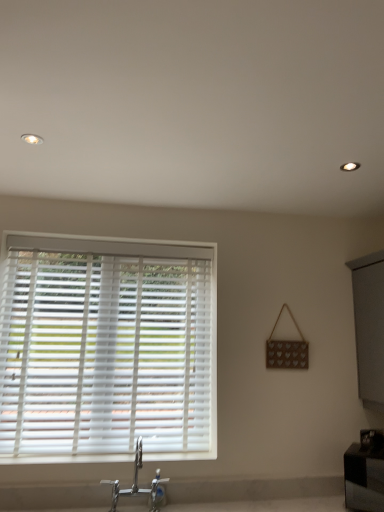
Question: Can you confirm if white plastic blinds at left is thinner than chrome metallic faucet at lower center?

Choices:
 (A) no
 (B) yes

Answer: (B)

Question: Is white plastic blinds at left to the right of chrome metallic faucet at lower center from the viewer's perspective?

Choices:
 (A) no
 (B) yes

Answer: (A)

Question: Can you confirm if white plastic blinds at left is shorter than chrome metallic faucet at lower center?

Choices:
 (A) no
 (B) yes

Answer: (A)

Question: From a real-world perspective, is white plastic blinds at left physically above chrome metallic faucet at lower center?

Choices:
 (A) no
 (B) yes

Answer: (B)

Question: Is the depth of white plastic blinds at left greater than that of chrome metallic faucet at lower center?

Choices:
 (A) yes
 (B) no

Answer: (A)

Question: Can you confirm if white plastic blinds at left is taller than chrome metallic faucet at lower center?

Choices:
 (A) yes
 (B) no

Answer: (A)

Question: Are chrome metallic faucet at lower center and white plastic blinds at left beside each other?

Choices:
 (A) yes
 (B) no

Answer: (B)

Question: Does chrome metallic faucet at lower center have a lesser width compared to white plastic blinds at left?

Choices:
 (A) yes
 (B) no

Answer: (B)

Question: From a real-world perspective, does chrome metallic faucet at lower center sit lower than white plastic blinds at left?

Choices:
 (A) no
 (B) yes

Answer: (B)

Question: From the image's perspective, is chrome metallic faucet at lower center located above white plastic blinds at left?

Choices:
 (A) no
 (B) yes

Answer: (A)

Question: Can we say chrome metallic faucet at lower center lies outside white plastic blinds at left?

Choices:
 (A) yes
 (B) no

Answer: (A)

Question: Considering the relative sizes of chrome metallic faucet at lower center and white plastic blinds at left in the image provided, is chrome metallic faucet at lower center taller than white plastic blinds at left?

Choices:
 (A) yes
 (B) no

Answer: (B)

Question: Is white plastic blinds at left completely or partially outside of black glossy vanity at lower right?

Choices:
 (A) yes
 (B) no

Answer: (A)